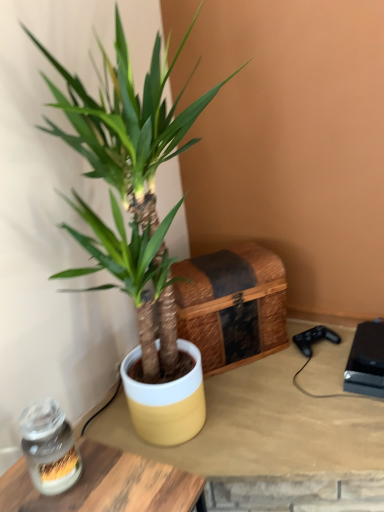
At what (x,y) coordinates should I click in order to perform the action: click on free space above woven wood chest at center (from a real-world perspective). Please return your answer as a coordinate pair (x, y). This screenshot has width=384, height=512. Looking at the image, I should click on (209, 261).